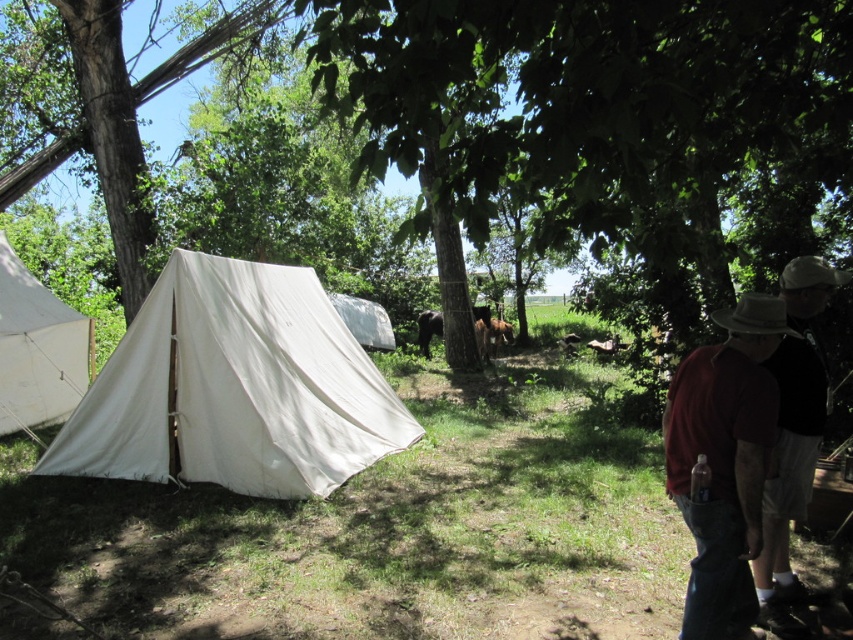
You are planning to set up a picnic blanket between the two people and the white canvas tent at left. The picnic blanket is 2 meters long. Will it fit comfortably between them?

The distance between the two people and the white canvas tent at left is 6.36 meters. Since the picnic blanket is only 2 meters long, there will be ample space left after placing it comfortably between them.